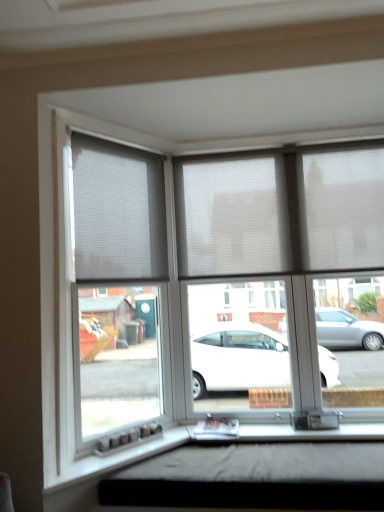
What is the approximate height of black matte window box at lower center?

The height of black matte window box at lower center is 6.89 inches.

The image size is (384, 512). In order to click on black matte window box at lower center in this screenshot , I will do `click(254, 477)`.

Can you confirm if white pleated blind at upper left is taller than white pleated blinds at center?

Yes, white pleated blind at upper left is taller than white pleated blinds at center.

Considering the relative sizes of white pleated blind at upper left and white pleated blinds at center in the image provided, is white pleated blind at upper left wider than white pleated blinds at center?

In fact, white pleated blind at upper left might be narrower than white pleated blinds at center.

Can you tell me how much white pleated blind at upper left and white pleated blinds at center differ in facing direction?

50.1 degrees separate the facing orientations of white pleated blind at upper left and white pleated blinds at center.

Can you confirm if white pleated blind at upper left is positioned to the right of white pleated blinds at center?

In fact, white pleated blind at upper left is to the left of white pleated blinds at center.

From a real-world perspective, between black matte window box at lower center and white pleated blinds at center, who is vertically higher?

From a 3D spatial view, white pleated blinds at center is above.

Is black matte window box at lower center in front of or behind white pleated blinds at center in the image?

Visually, black matte window box at lower center is located in front of white pleated blinds at center.

This screenshot has height=512, width=384. Find the location of `window box that appears in front of the white pleated blinds at center`. window box that appears in front of the white pleated blinds at center is located at coordinates (254, 477).

Is point (178, 468) closer or farther from the camera than point (218, 230)?

Point (178, 468) is closer to the camera than point (218, 230).

Is white pleated blind at upper left located within white pleated blinds at center?

No, white pleated blind at upper left is located outside of white pleated blinds at center.

Looking at this image, considering the sizes of objects white pleated blinds at center and white pleated blind at upper left in the image provided, who is shorter, white pleated blinds at center or white pleated blind at upper left?

white pleated blinds at center.

Is white pleated blinds at center closer to camera compared to white pleated blind at upper left?

No, the depth of white pleated blinds at center is greater than that of white pleated blind at upper left.

Can you see white pleated blinds at center touching black matte window box at lower center?

No, white pleated blinds at center is not with black matte window box at lower center.

Could you tell me if white pleated blinds at center is facing black matte window box at lower center?

No, white pleated blinds at center does not turn towards black matte window box at lower center.

Is white pleated blinds at center not within black matte window box at lower center?

Yes.

Is point (260, 201) positioned in front of point (211, 501)?

That is False.

Considering the relative sizes of white pleated blind at upper left and black matte window box at lower center in the image provided, is white pleated blind at upper left taller than black matte window box at lower center?

Correct, white pleated blind at upper left is much taller as black matte window box at lower center.

Is white pleated blind at upper left thinner than black matte window box at lower center?

Correct, the width of white pleated blind at upper left is less than that of black matte window box at lower center.

Would you say black matte window box at lower center contains white pleated blind at upper left?

No, white pleated blind at upper left is not a part of black matte window box at lower center.

From the image's perspective, is black matte window box at lower center below white pleated blind at upper left?

Yes.

Which point is more forward, [221,487] or [80,221]?

The point [221,487] is closer.

The height and width of the screenshot is (512, 384). I want to click on blind behind the white pleated blind at upper left, so tap(281, 211).

Locate an element on the screen. The width and height of the screenshot is (384, 512). blind above the black matte window box at lower center (from a real-world perspective) is located at coordinates point(281,211).

From the image, which object appears to be farther from white pleated blinds at center, black matte window box at lower center or white pleated blind at upper left?

black matte window box at lower center lies further to white pleated blinds at center than the other object.

When comparing their distances from black matte window box at lower center, does white pleated blinds at center or white pleated blind at upper left seem closer?

white pleated blinds at center is closer to black matte window box at lower center.

Which object lies further to the anchor point white pleated blind at upper left, black matte window box at lower center or white pleated blinds at center?

black matte window box at lower center is positioned further to the anchor white pleated blind at upper left.

From the image, which object appears to be farther from black matte window box at lower center, white pleated blind at upper left or white pleated blinds at center?

Based on the image, white pleated blind at upper left appears to be further to black matte window box at lower center.

From the image, which object appears to be farther from white pleated blind at upper left, white pleated blinds at center or black matte window box at lower center?

Among the two, black matte window box at lower center is located further to white pleated blind at upper left.

Which object lies nearer to the anchor point white pleated blinds at center, white pleated blind at upper left or black matte window box at lower center?

white pleated blind at upper left is closer to white pleated blinds at center.

You are a GUI agent. You are given a task and a screenshot of the screen. Output one action in this format:
    pyautogui.click(x=<x>, y=<y>)
    Task: Click on the window blind between white pleated blinds at center and black matte window box at lower center in the vertical direction
    This screenshot has height=512, width=384.
    Given the screenshot: What is the action you would take?
    pyautogui.click(x=118, y=212)